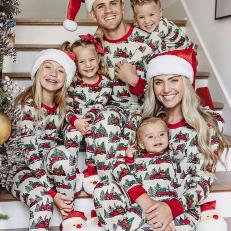
Image resolution: width=231 pixels, height=231 pixels. I want to click on stuffed santa, so click(208, 220).